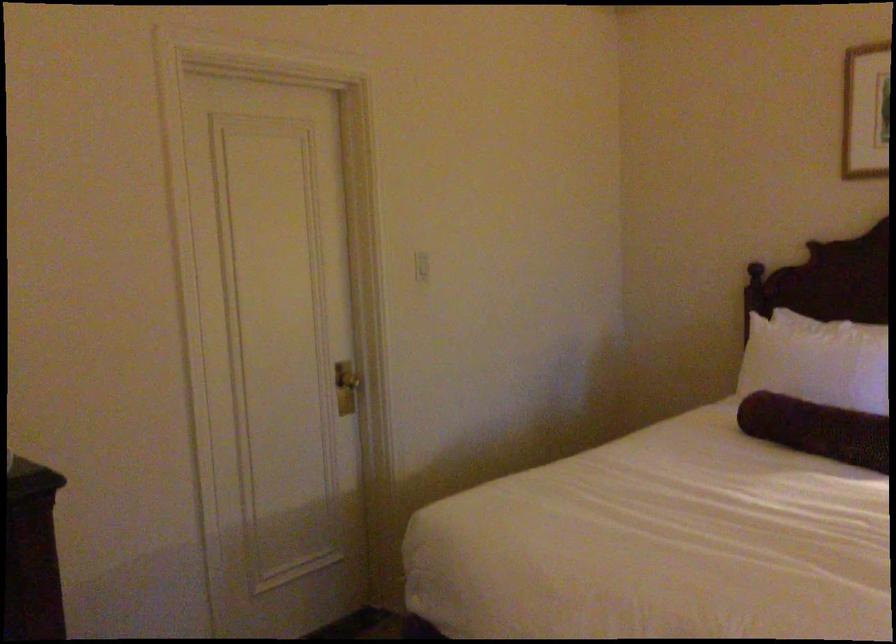
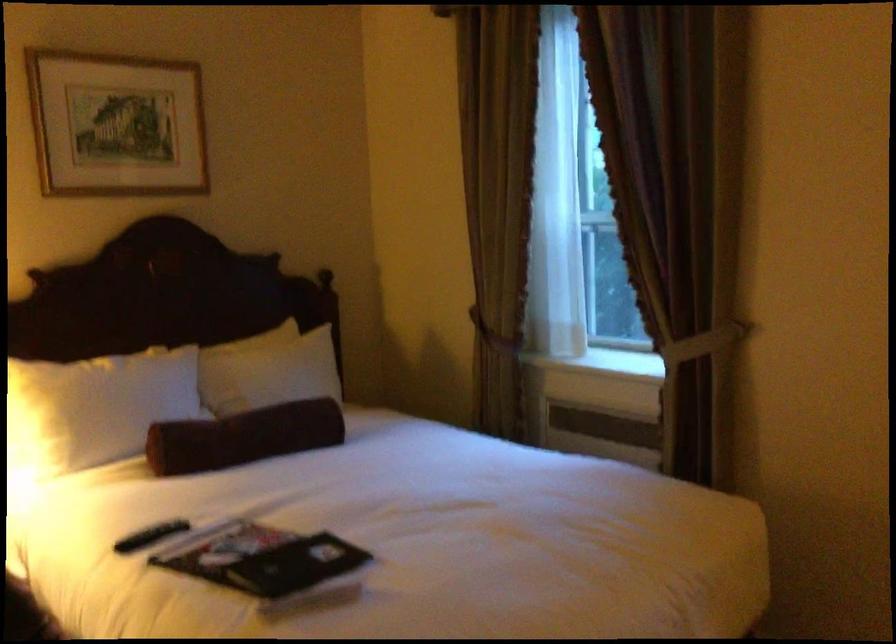
Question: Based on the continuous images, in which direction is the camera rotating? Reply with the corresponding letter.

Choices:
 (A) Left
 (B) Right
 (C) Up
 (D) Down

Answer: (B)